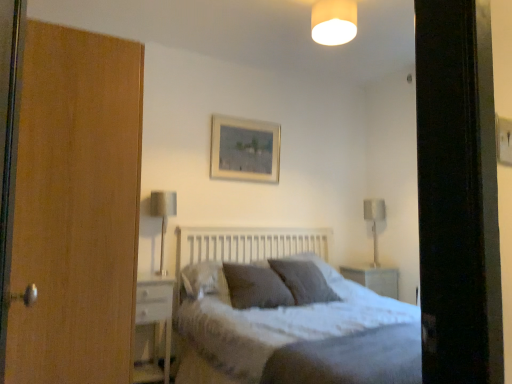
Question: From a real-world perspective, relative to textured gray pillow at center, the third pillow when ordered from back to front, is textured gray bed at center vertically above or below?

Choices:
 (A) below
 (B) above

Answer: (A)

Question: Is point (197, 365) closer or farther from the camera than point (271, 288)?

Choices:
 (A) closer
 (B) farther

Answer: (A)

Question: Estimate the real-world distances between objects in this image. Which object is farther from the textured gray pillow at center, the third pillow when ordered from back to front?

Choices:
 (A) white glossy nightstand at lower left
 (B) wooden picture frame at upper center
 (C) dark gray textured pillow at center, the first pillow from the back
 (D) matte white lampshade at upper center
 (E) metallic silver table lamp at right, which ranks as the second table lamp in left-to-right order

Answer: (D)

Question: Estimate the real-world distances between objects in this image. Which object is closer to the textured gray pillow at center, the third pillow when ordered from back to front?

Choices:
 (A) textured gray bed at center
 (B) textured gray pillow at center, the second pillow viewed from the back
 (C) wooden picture frame at upper center
 (D) matte white lampshade at upper center
 (E) metallic silver table lamp at right, which is the 1th table lamp in right-to-left order

Answer: (B)